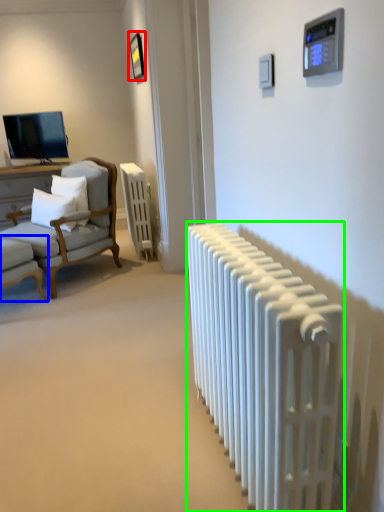
Question: Considering the real-world distances, which object is closest to picture frame (highlighted by a red box)? chair (highlighted by a blue box) or radiator (highlighted by a green box).

Choices:
 (A) chair
 (B) radiator

Answer: (A)